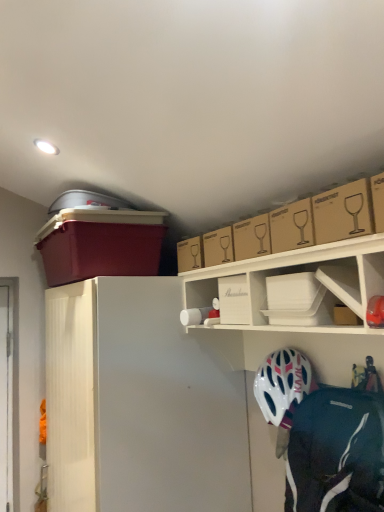
Question: From the image's perspective, is brown cardboard box at upper right, which is counted as the 1th box, starting from the right, located above or below transparent plastic screen door at left?

Choices:
 (A) above
 (B) below

Answer: (A)

Question: Visually, is brown cardboard box at upper right, which ranks as the 1th box in front-to-back order, positioned to the left or to the right of transparent plastic screen door at left?

Choices:
 (A) right
 (B) left

Answer: (A)

Question: Estimate the real-world distances between objects in this image. Which object is closer to the matte plastic storage bin at upper left, which is the 4th box from front to back?

Choices:
 (A) white matte shelf at upper center
 (B) white matte helmet at lower right
 (C) brown cardboard box at upper right, marked as the 4th box in a back-to-front arrangement
 (D) transparent plastic screen door at left
 (E) brown cardboard box at upper center, which ranks as the third box in right-to-left order

Answer: (E)

Question: Which object is the closest to the transparent plastic screen door at left?

Choices:
 (A) brown cardboard box at upper right
 (B) brown cardboard box at upper right, which ranks as the 1th box in front-to-back order
 (C) white matte refrigerator at left
 (D) white plastic container at upper center, placed as the second box when sorted from right to left
 (E) white matte helmet at lower right

Answer: (C)